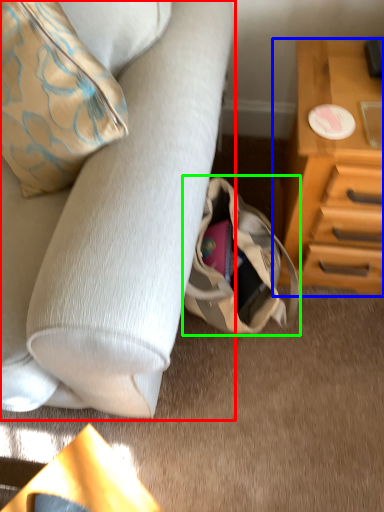
Question: Estimate the real-world distances between objects in this image. Which object is farther from studio couch (highlighted by a red box), chest of drawers (highlighted by a blue box) or handbag (highlighted by a green box)?

Choices:
 (A) chest of drawers
 (B) handbag

Answer: (A)